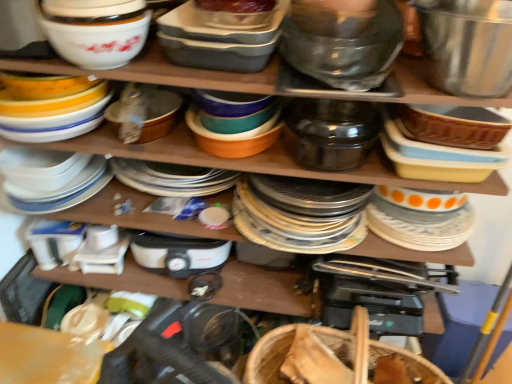
Question: Is white glossy bowl at upper left, marked as the 4th bowl in a right-to-left arrangement, positioned in front of white glossy bowl at upper left, the 2th appliance when ordered from right to left?

Choices:
 (A) yes
 (B) no

Answer: (A)

Question: Is white glossy bowl at upper left, marked as the 4th bowl in a right-to-left arrangement, facing away from white glossy bowl at upper left, positioned as the 1th appliance in left-to-right order?

Choices:
 (A) no
 (B) yes

Answer: (A)

Question: Does white glossy bowl at upper left, marked as the 4th bowl in a right-to-left arrangement, have a smaller size compared to white glossy bowl at upper left, positioned as the 1th appliance in left-to-right order?

Choices:
 (A) no
 (B) yes

Answer: (B)

Question: From the image's perspective, is white glossy bowl at upper left, marked as the 4th bowl in a right-to-left arrangement, above white glossy bowl at upper left, positioned as the 1th appliance in left-to-right order?

Choices:
 (A) yes
 (B) no

Answer: (A)

Question: Can you confirm if white glossy bowl at upper left, the 1th bowl in the left-to-right sequence, is shorter than white glossy bowl at upper left, the 2th appliance when ordered from right to left?

Choices:
 (A) no
 (B) yes

Answer: (A)

Question: From a real-world perspective, is white glossy bowl at upper left, the 1th bowl in the left-to-right sequence, positioned over white glossy bowl at upper left, the 2th appliance when ordered from right to left, based on gravity?

Choices:
 (A) no
 (B) yes

Answer: (B)

Question: Does white glossy bowl at upper left, positioned as the 1th appliance in left-to-right order, lie in front of satin black pot at center, which is counted as the 2th appliance, starting from the left?

Choices:
 (A) no
 (B) yes

Answer: (A)

Question: Does white glossy bowl at upper left, the 2th appliance when ordered from right to left, have a smaller size compared to satin black pot at center, which is counted as the 2th appliance, starting from the left?

Choices:
 (A) yes
 (B) no

Answer: (B)

Question: Considering the relative positions of white glossy bowl at upper left, the 2th appliance when ordered from right to left, and satin black pot at center, which is the 1th appliance in right-to-left order, in the image provided, is white glossy bowl at upper left, the 2th appliance when ordered from right to left, to the left of satin black pot at center, which is the 1th appliance in right-to-left order, from the viewer's perspective?

Choices:
 (A) yes
 (B) no

Answer: (A)

Question: Is white glossy bowl at upper left, positioned as the 1th appliance in left-to-right order, not near satin black pot at center, which is the 1th appliance in right-to-left order?

Choices:
 (A) yes
 (B) no

Answer: (B)

Question: From a real-world perspective, is white glossy bowl at upper left, positioned as the 1th appliance in left-to-right order, below satin black pot at center, which is counted as the 2th appliance, starting from the left?

Choices:
 (A) no
 (B) yes

Answer: (A)

Question: Is white glossy bowl at upper left, the 2th appliance when ordered from right to left, oriented away from satin black pot at center, which is the 1th appliance in right-to-left order?

Choices:
 (A) yes
 (B) no

Answer: (B)

Question: Is white glossy bowl at upper left, the 2th appliance when ordered from right to left, positioned behind white glossy bowl at upper left, the 1th bowl in the left-to-right sequence?

Choices:
 (A) yes
 (B) no

Answer: (A)